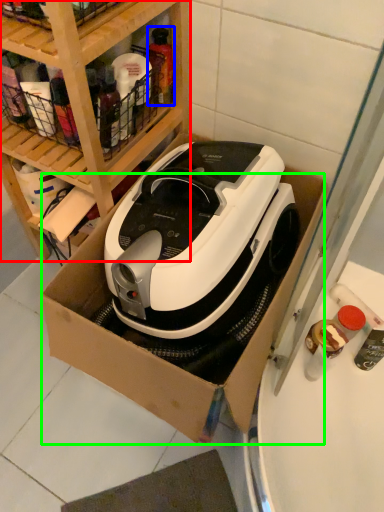
Question: Which object is positioned farthest from shelf (highlighted by a red box)? Select from bottle (highlighted by a blue box) and cardboard box (highlighted by a green box).

Choices:
 (A) bottle
 (B) cardboard box

Answer: (B)